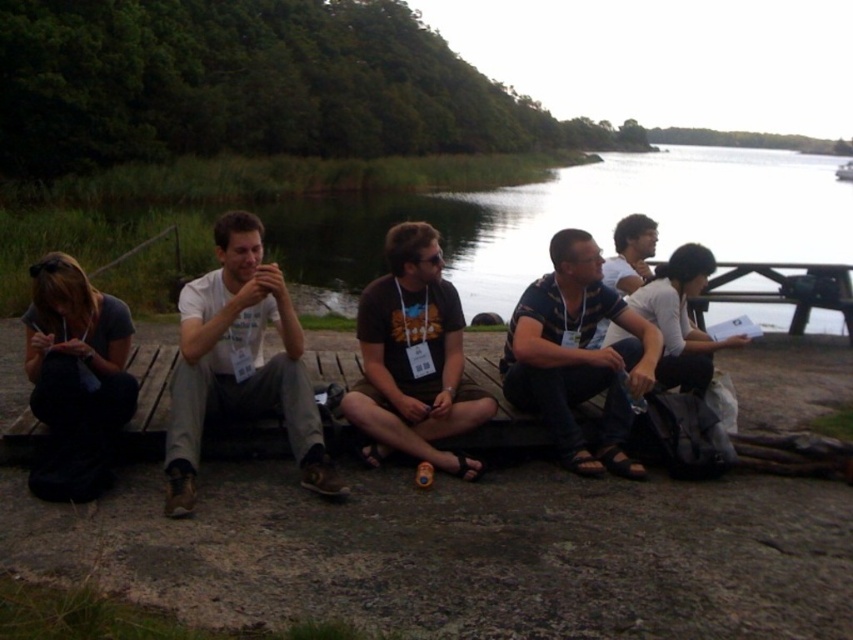
Between point (236, 243) and point (585, 257), which one is positioned in front?

Point (236, 243) is more forward.

Who is taller, white matte shirt at center or striped cotton shirt at center?

white matte shirt at center

The height and width of the screenshot is (640, 853). What are the coordinates of `white matte shirt at center` in the screenshot? It's located at (239, 364).

You are a GUI agent. You are given a task and a screenshot of the screen. Output one action in this format:
    pyautogui.click(x=<x>, y=<y>)
    Task: Click on the white matte shirt at center
    
    Given the screenshot: What is the action you would take?
    pyautogui.click(x=239, y=364)

Which is above, brown cotton t-shirt at center or striped cotton shirt at center?

Positioned higher is brown cotton t-shirt at center.

Is brown cotton t-shirt at center wider than striped cotton shirt at center?

No, brown cotton t-shirt at center is not wider than striped cotton shirt at center.

Is point (383, 380) closer to viewer compared to point (613, 397)?

Yes.

In order to click on brown cotton t-shirt at center in this screenshot , I will do `click(415, 358)`.

Is white matte shirt at center bigger than brown cotton t-shirt at center?

Yes, white matte shirt at center is bigger than brown cotton t-shirt at center.

Can you confirm if white matte shirt at center is thinner than brown cotton t-shirt at center?

No.

Locate an element on the screen. white matte shirt at center is located at coordinates (239, 364).

This screenshot has height=640, width=853. Identify the location of white matte shirt at center. (239, 364).